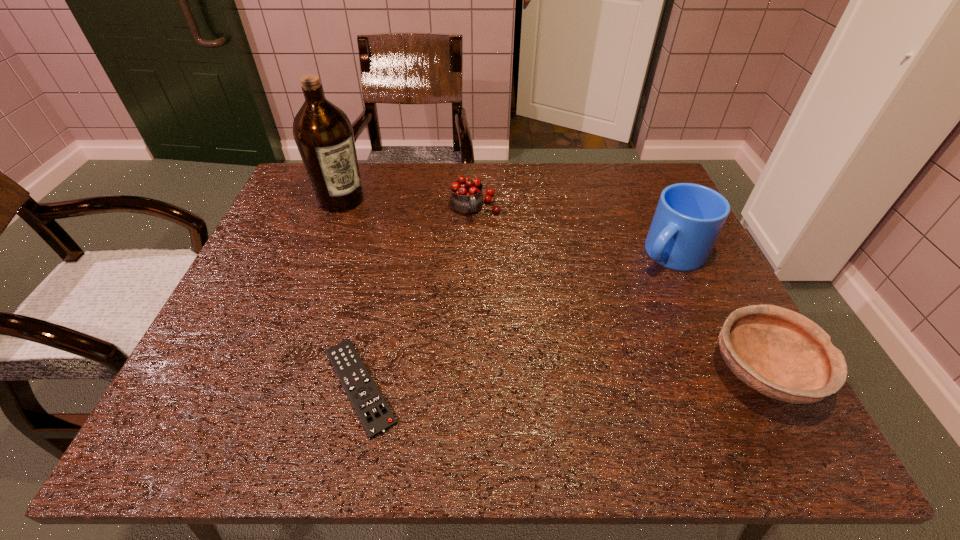
Find the location of a particular element. vacant space in between the remote control and the fourth tallest object is located at coordinates (562, 379).

Identify which object is the second nearest to the mug. Please provide its 2D coordinates. Your answer should be formatted as a tuple, i.e. [(x, y)], where the tuple contains the x and y coordinates of a point satisfying the conditions above.

[(466, 198)]

I want to click on object that stands as the third closest to the shortest object, so click(688, 219).

What are the coordinates of `vacant space that satisfies the following two spatial constraints: 1. on the front side of the bowl; 2. on the left side of the olive oil` in the screenshot? It's located at (276, 372).

The image size is (960, 540). I want to click on free region that satisfies the following two spatial constraints: 1. on the front side of the pot filled with cherries; 2. on the right side of the second shortest object, so click(473, 372).

The height and width of the screenshot is (540, 960). Identify the location of vacant area in the image that satisfies the following two spatial constraints: 1. on the front side of the tallest object; 2. on the right side of the remote control. (270, 387).